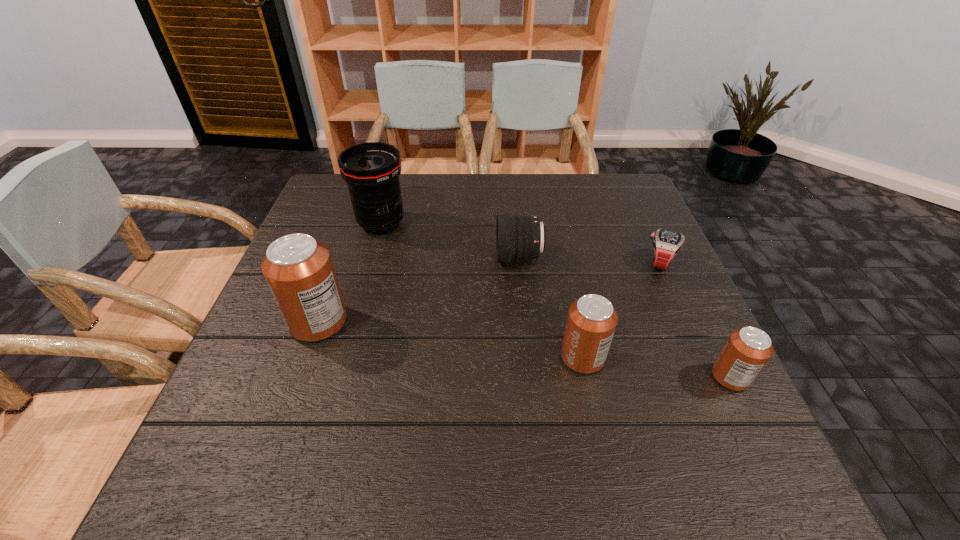
Identify the location of free space between the tallest can and the farther telephoto lens. The width and height of the screenshot is (960, 540). (349, 273).

Find the location of a particular element. The width and height of the screenshot is (960, 540). blank region between the shortest object and the third tallest object is located at coordinates (621, 310).

The width and height of the screenshot is (960, 540). In order to click on vacant area that lies between the watch and the rightmost can in this screenshot , I will do `click(695, 320)`.

This screenshot has height=540, width=960. Find the location of `unoccupied area between the shortest can and the fourth shortest object`. unoccupied area between the shortest can and the fourth shortest object is located at coordinates (657, 367).

At what (x,y) coordinates should I click in order to perform the action: click on vacant region between the left telephoto lens and the rightmost can. Please return your answer as a coordinate pair (x, y). Looking at the image, I should click on click(x=556, y=300).

Locate an element on the screen. vacant area that lies between the shortest can and the second can from left to right is located at coordinates (657, 367).

The image size is (960, 540). I want to click on vacant space in between the leftmost can and the farthest object, so click(x=349, y=273).

Locate an element on the screen. free space between the tallest can and the third tallest object is located at coordinates (450, 340).

Locate an element on the screen. This screenshot has height=540, width=960. vacant point located between the shortest object and the right telephoto lens is located at coordinates (589, 260).

Locate which object is the fourth closest to the rightmost can. Please provide its 2D coordinates. Your answer should be formatted as a tuple, i.e. [(x, y)], where the tuple contains the x and y coordinates of a point satisfying the conditions above.

[(298, 269)]